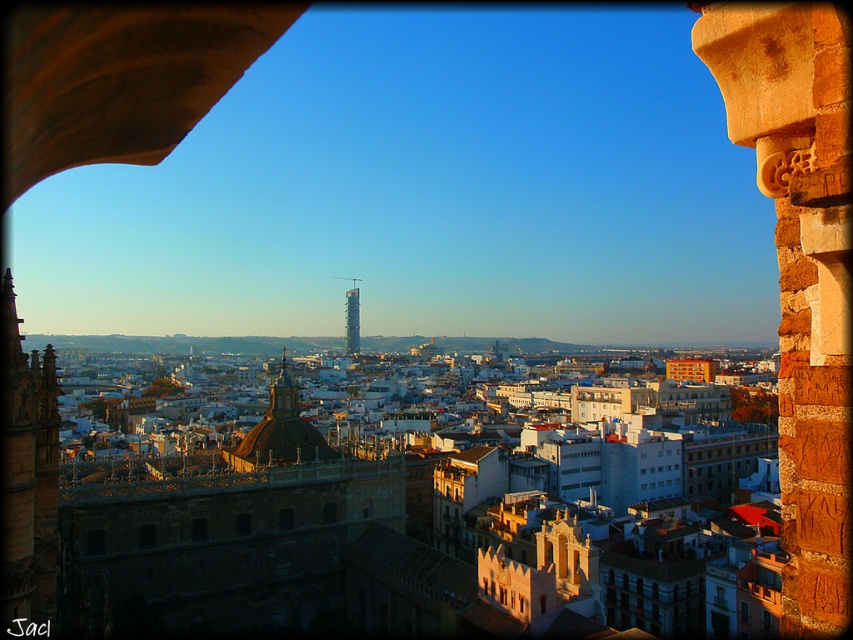
Is brown stone column at center right below metallic glass tower at center?

Indeed, brown stone column at center right is positioned under metallic glass tower at center.

Between brown stone column at center right and metallic glass tower at center, which one has less height?

Standing shorter between the two is metallic glass tower at center.

Does point (796, 152) come behind point (347, 291)?

No, it is in front of (347, 291).

In order to click on brown stone column at center right in this screenshot , I will do `click(801, 269)`.